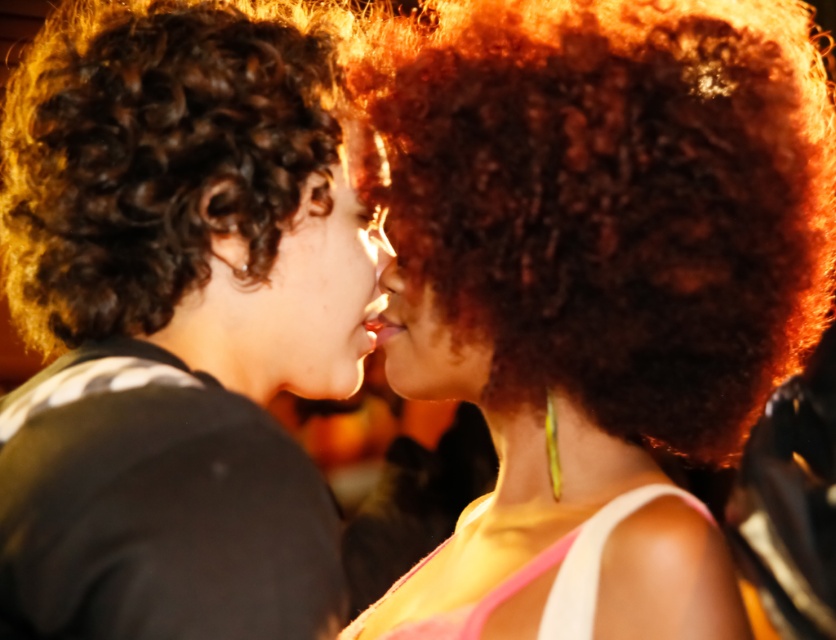
Can you confirm if matte black shirt at center is positioned to the right of smooth skin face at center?

Incorrect, matte black shirt at center is not on the right side of smooth skin face at center.

Does point (103, 17) lie in front of point (304, 216)?

No.

Find the location of a particular element. This screenshot has width=836, height=640. matte black shirt at center is located at coordinates (174, 323).

The height and width of the screenshot is (640, 836). Identify the location of matte black shirt at center. (174, 323).

Is shiny brown hair at center wider than smooth skin face at center?

Yes, shiny brown hair at center is wider than smooth skin face at center.

Does point (717, 568) come behind point (273, 390)?

Yes, it is behind point (273, 390).

What are the coordinates of `shiny brown hair at center` in the screenshot? It's located at (599, 292).

Is point (733, 602) in front of point (218, 317)?

No, (733, 602) is further to viewer.

Which of these two, shiny brown hair at center or matte black shirt at center, stands shorter?

matte black shirt at center is shorter.

Is point (679, 355) positioned before point (46, 564)?

No, (679, 355) is further to viewer.

At what (x,y) coordinates should I click in order to perform the action: click on shiny brown hair at center. Please return your answer as a coordinate pair (x, y). The width and height of the screenshot is (836, 640). Looking at the image, I should click on (599, 292).